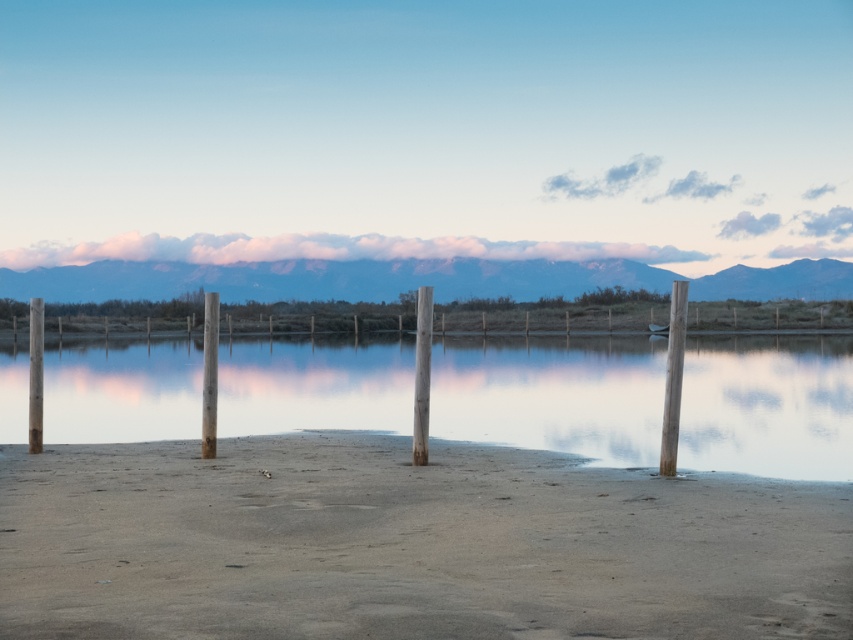
You are standing on the beach and want to place a small flag on the tallest wooden post between the smooth wood post at right and the wooden post at center. Which post should you choose?

The smooth wood post at right is taller than the wooden post at center, so you should place the flag on the smooth wood post at right.

You are standing on the beach and see two points marked on the wooden posts. The first point is at coordinates point (234, 358) and the second is at point (33, 385). Which point is closer to you?

Point (234, 358) is closer to you because it is further to the viewer than point (33, 385).